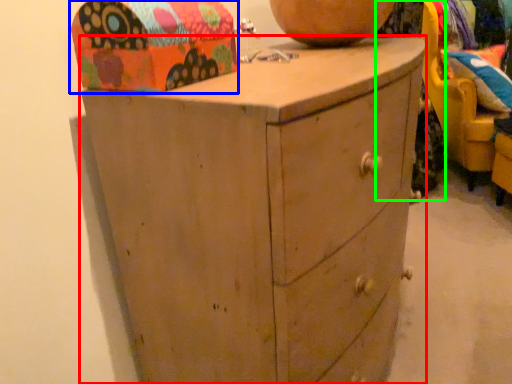
Question: Which object is positioned closest to chest of drawers (highlighted by a red box)? Select from shoe box (highlighted by a blue box) and clothing (highlighted by a green box).

Choices:
 (A) shoe box
 (B) clothing

Answer: (A)